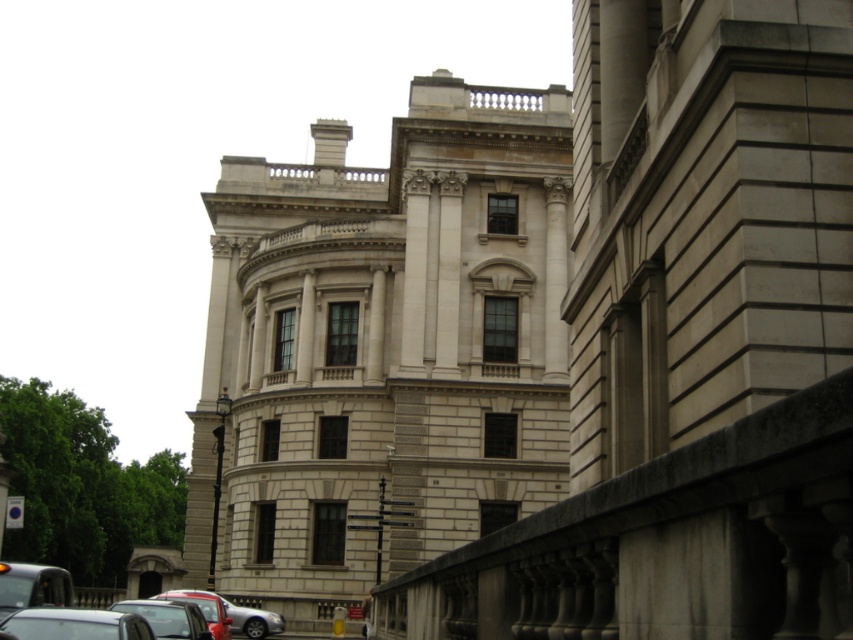
Question: Can you confirm if metallic silver car at lower left is bigger than matte black car at lower left?

Choices:
 (A) yes
 (B) no

Answer: (B)

Question: Which object is closer to the camera taking this photo?

Choices:
 (A) silver metallic car at lower left
 (B) metallic silver car at lower left

Answer: (B)

Question: Is matte black car at lower left smaller than silver metallic car at lower left?

Choices:
 (A) yes
 (B) no

Answer: (B)

Question: Is metallic silver car at lower left wider than shiny red car at lower left?

Choices:
 (A) yes
 (B) no

Answer: (B)

Question: Which object is the closest to the metallic silver car at lower left?

Choices:
 (A) shiny red car at lower left
 (B) matte black car at lower left

Answer: (B)

Question: Which object appears farthest from the camera in this image?

Choices:
 (A) metallic silver car at lower left
 (B) shiny red car at lower left

Answer: (B)